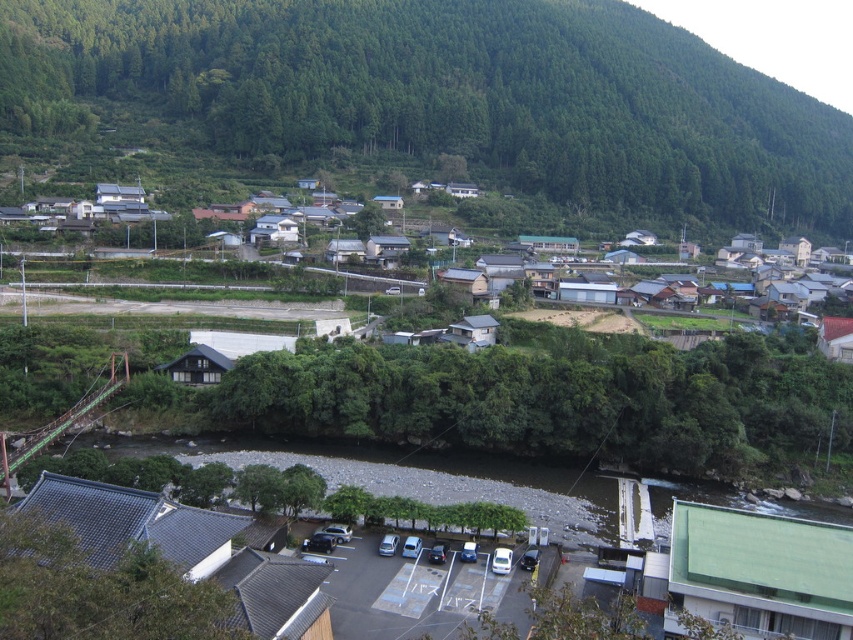
You are standing at the parking lot and want to reach the suspension bridge. You see two points marked as point 1 at coordinates point (585,88) and point 2 at coordinates point (268,227). Which point is closer to you as you stand at the parking lot?

Point (585,88) is further to the viewer than point (268,227), so point (268,227) is closer to you as you stand at the parking lot.